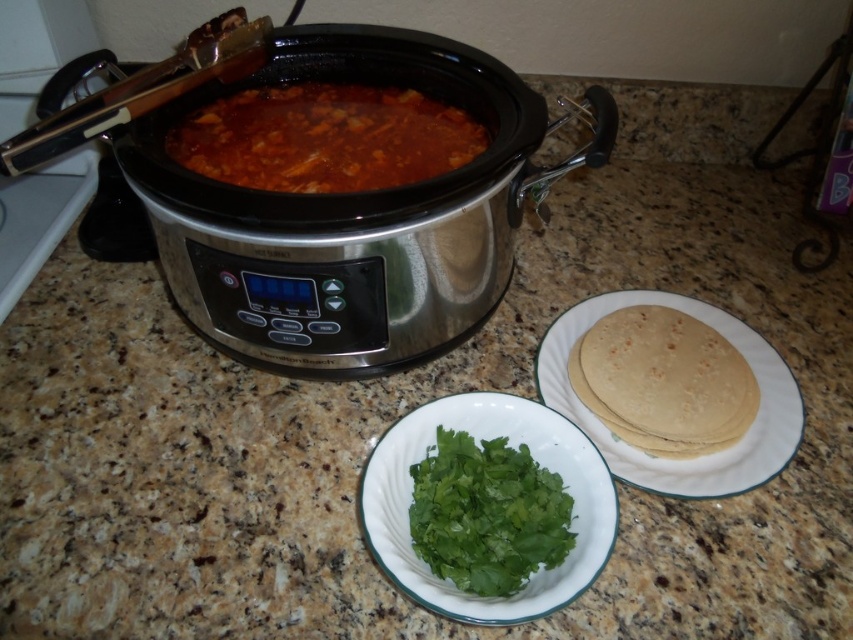
You are preparing to garnish the slow cooker stew with the green leafy herb at center and the green leafy at center. Which one is positioned to the left?

The green leafy herb at center is positioned to the left of the green leafy at center.

You are preparing to serve food from the brown matte stew at center using the metallic silver tong at upper left. Can you easily reach the stew with the tongs?

The brown matte stew at center is positioned under the metallic silver tong at upper left, so yes, you can easily reach the stew with the tongs.